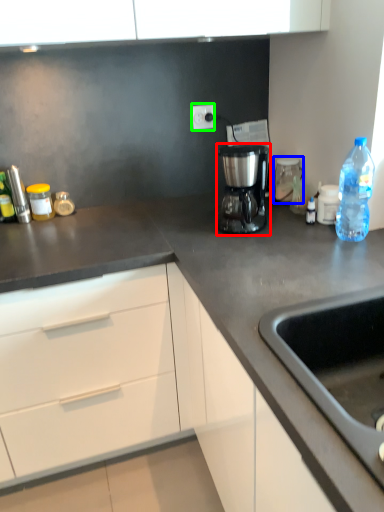
Question: Which object is positioned closest to coffee maker (highlighted by a red box)? Select from home appliance (highlighted by a blue box) and electric outlet (highlighted by a green box).

Choices:
 (A) home appliance
 (B) electric outlet

Answer: (A)